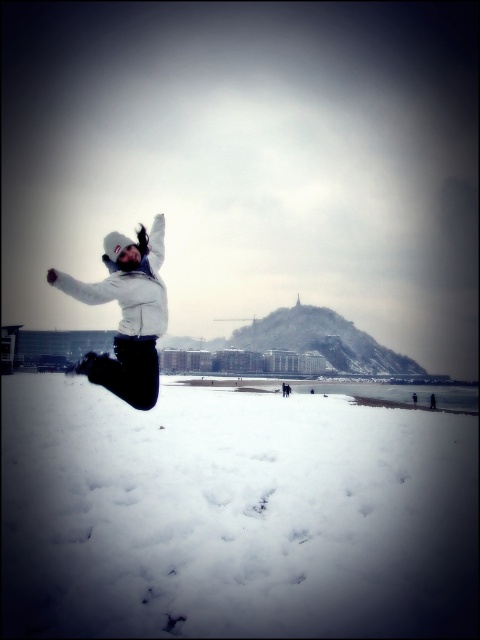
Who is positioned more to the left, white fluffy snow at lower center or white matte jacket at center?

From the viewer's perspective, white matte jacket at center appears more on the left side.

Between white fluffy snow at lower center and white matte jacket at center, which one has more height?

Standing taller between the two is white matte jacket at center.

Describe the element at coordinates (233, 515) in the screenshot. I see `white fluffy snow at lower center` at that location.

The width and height of the screenshot is (480, 640). Find the location of `white fluffy snow at lower center`. white fluffy snow at lower center is located at coordinates (233, 515).